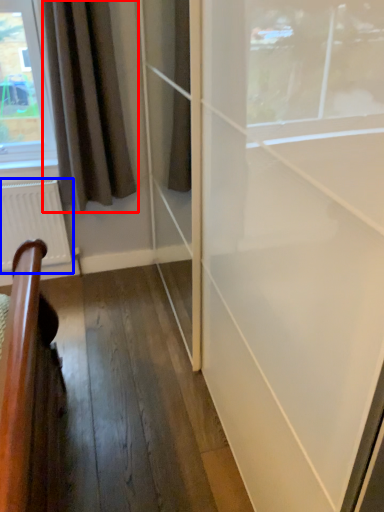
Question: Which object is further to the camera taking this photo, curtain (highlighted by a red box) or radiator (highlighted by a blue box)?

Choices:
 (A) curtain
 (B) radiator

Answer: (B)